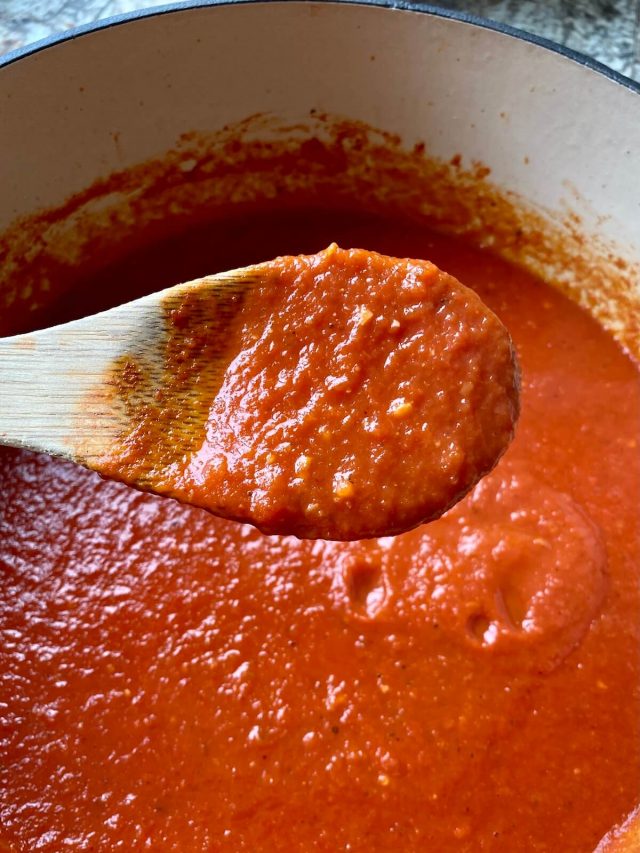
Locate an element on the screen. table is located at coordinates (608, 22).